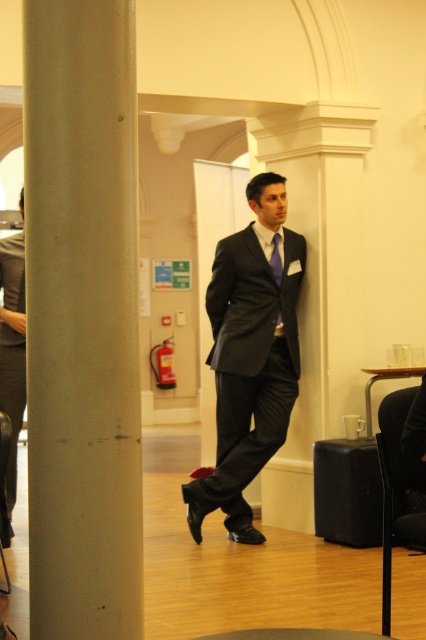
You are planning to rearrange the seating in the event space and need to know if the black plastic chair at lower right can fit in a smaller area than the matte black suit at center. Based on the image, can it?

The black plastic chair at lower right occupies less space than the matte black suit at center, so yes, it can fit in a smaller area.

You are standing in the room and want to walk to both points. Which point is closer to you, point (382, 477) or point (5, 484)?

Point (382, 477) is closer to the viewer than point (5, 484).